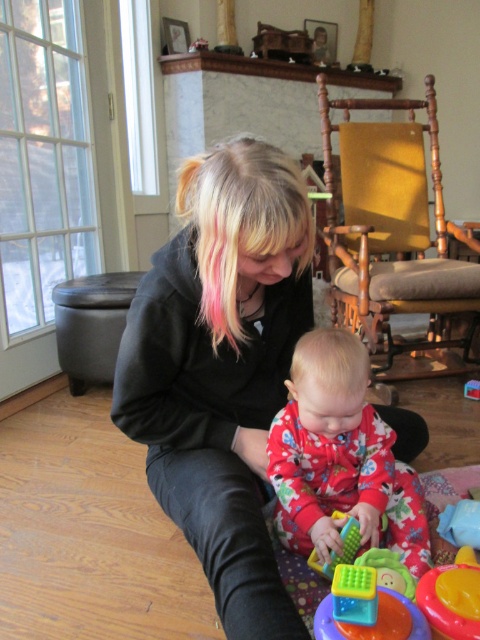
Question: Observing the image, what is the correct spatial positioning of fluffy red pajamas at center in reference to green plastic toy at center?

Choices:
 (A) left
 (B) right

Answer: (B)

Question: Among these points, which one is farthest from the camera?

Choices:
 (A) (115, 360)
 (B) (361, 605)
 (C) (447, 609)
 (D) (343, 531)

Answer: (A)

Question: Which object is the closest to the green plastic toy at center?

Choices:
 (A) black matte jacket at center
 (B) green plastic cube at lower center

Answer: (B)

Question: Is black matte jacket at center bigger than blondehair at center?

Choices:
 (A) no
 (B) yes

Answer: (B)

Question: Does rubber yellow cup at lower right appear over green plastic toy at center?

Choices:
 (A) no
 (B) yes

Answer: (B)

Question: Which of the following is the farthest from the observer?

Choices:
 (A) translucent plastic cube at lower center
 (B) blonde silky hair at center

Answer: (B)